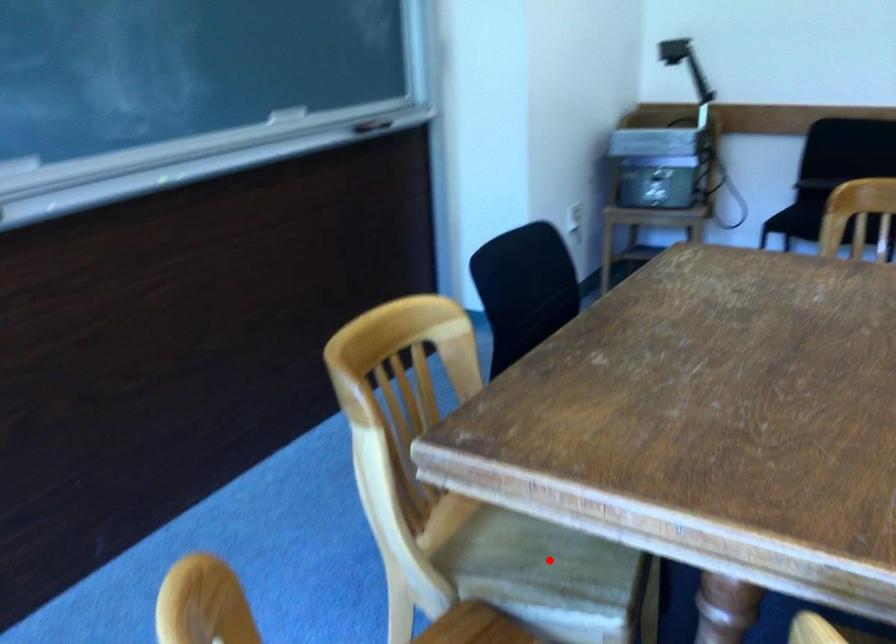
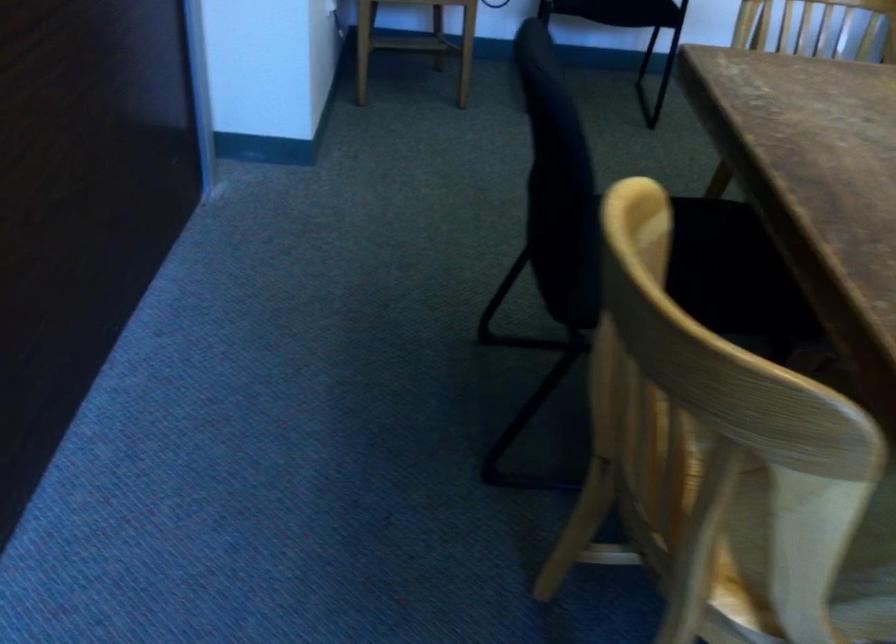
The point at the highlighted location is marked in the first image. Where is the corresponding point in the second image?

(872, 538)